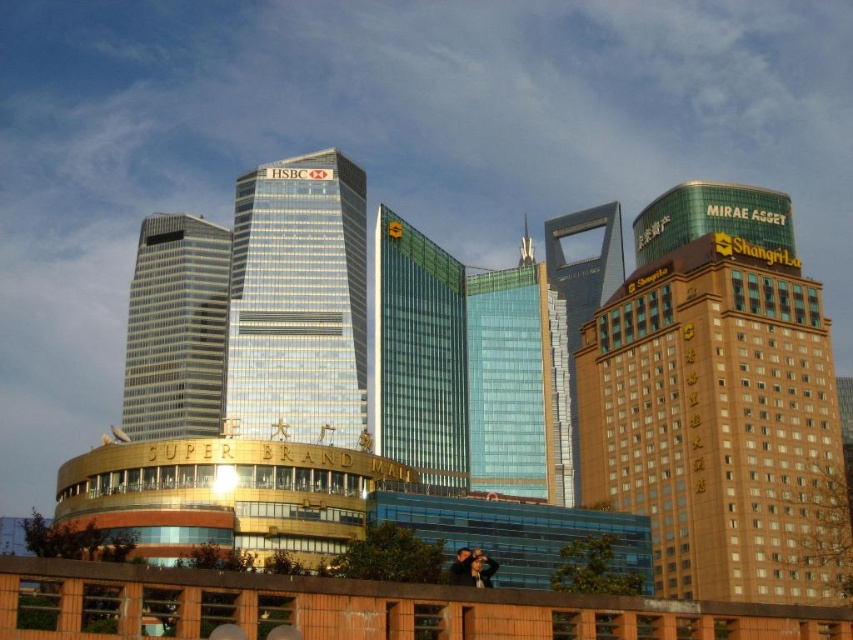
Based on the photo, you are an architect reviewing the urban skyline design. You need to determine the spatial arrangement between the glassy metallic skyscraper at center and the silver glass skyscraper at center. Which one is located to the right of the other?

The glassy metallic skyscraper at center is positioned on the right side of silver glass skyscraper at center.